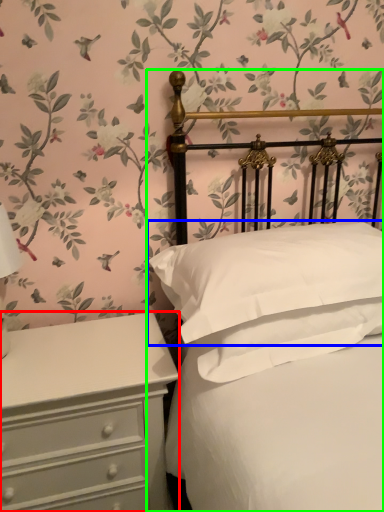
Question: Which is nearer to the chest of drawers (highlighted by a red box)? pillow (highlighted by a blue box) or bed (highlighted by a green box).

Choices:
 (A) pillow
 (B) bed

Answer: (A)